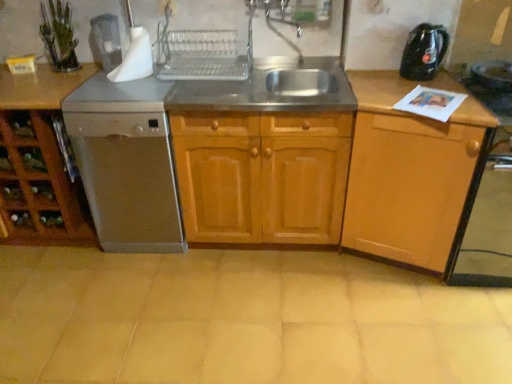
Find the location of a particular element. The image size is (512, 384). vacant space in front of black plastic kettle at upper right is located at coordinates (435, 90).